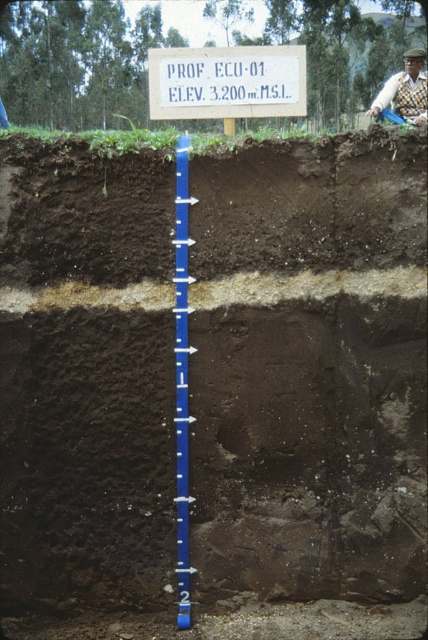
You are a geologist examining the soil profile. You need to place a 1.5 meter long sampling tool horizontally between the dark brown soil at center and the white plastic sign at upper center. Considering their widths, will the tool fit without overlapping either object?

The dark brown soil at center is wider than the white plastic sign at upper center. Since the tool is 1.5 meters long, it depends on the actual widths. However, the description only states the dark brown soil is wider, but doesn

You are a geologist analyzing the soil profile. You need to locate the dark brown soil at center. Where exactly is it located in the image?

The dark brown soil at center is located at point coordinates of [309,202].

You are standing at the point labeled with coordinates (33, 141) in the soil profile excavation. You want to reach the bottom of the excavation, which is 2 meters deep. Can you determine if the distance from your current position to the bottom is sufficient to allow you to safely descend using a ladder that requires at least 4 meters of vertical clearance?

The distance between the point labeled with coordinates (33, 141) and the bottom of the excavation is 3.69 meters. Since the ladder requires at least 4 meters of vertical clearance, the distance is insufficient. You would need a ladder that can manage with less clearance or find another way down.